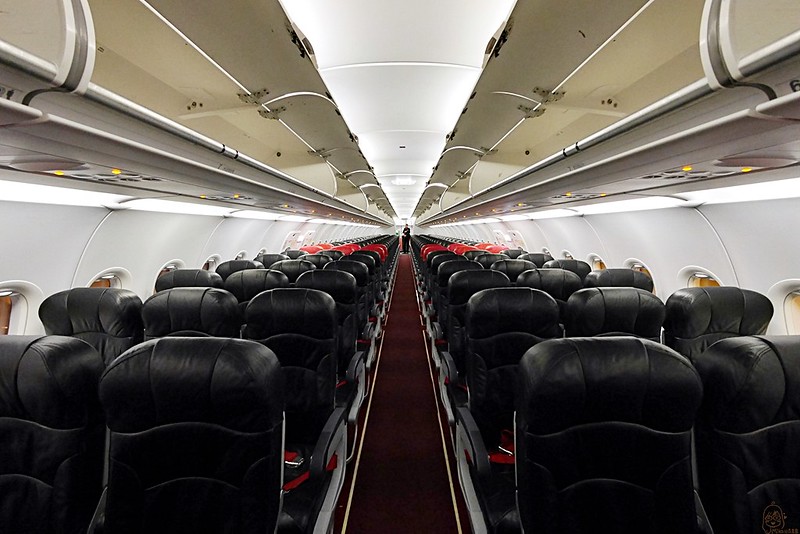
This screenshot has height=534, width=800. Find the location of `overhead compartments`. overhead compartments is located at coordinates (46, 25), (202, 96), (346, 189), (370, 207), (380, 215), (418, 218), (432, 211), (458, 195), (572, 131), (753, 34).